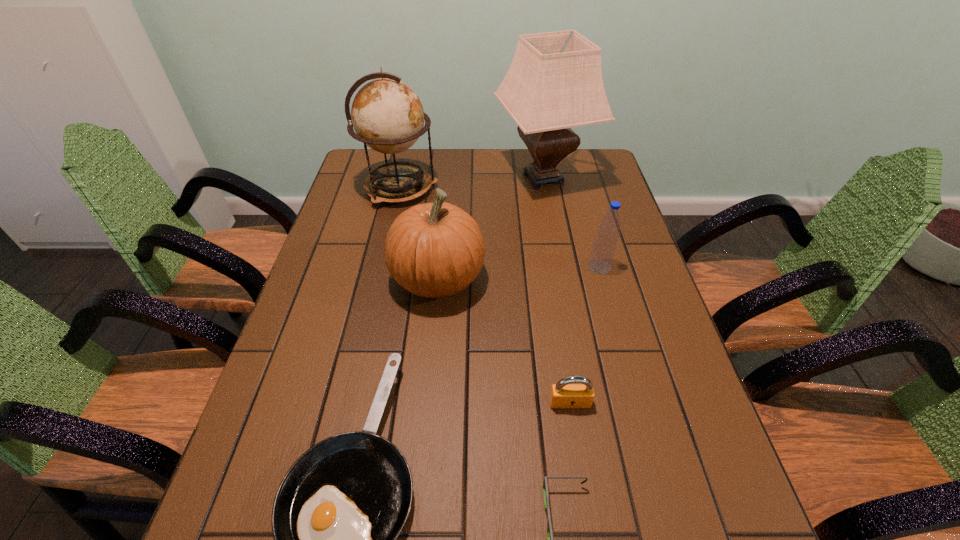
I want to click on lampshade, so click(x=554, y=83).

Identify the location of globe. (387, 115).

What are the coordinates of `the fifth shortest object` in the screenshot? It's located at (433, 250).

You are a GUI agent. You are given a task and a screenshot of the screen. Output one action in this format:
    pyautogui.click(x=<x>, y=<y>)
    Task: Click on the fourth shortest object
    The image size is (960, 540).
    Given the screenshot: What is the action you would take?
    pyautogui.click(x=604, y=247)

In order to click on padlock in this screenshot , I will do `click(564, 394)`.

At what (x,y) coordinates should I click in order to perform the action: click on vacant space located 0.330m on the front of the lampshade. Please return your answer as a coordinate pair (x, y). Image resolution: width=960 pixels, height=540 pixels. Looking at the image, I should click on (563, 282).

You are a GUI agent. You are given a task and a screenshot of the screen. Output one action in this format:
    pyautogui.click(x=<x>, y=<y>)
    Task: Click on the vacant space situated 0.340m at the center of the globe
    This screenshot has height=540, width=960.
    Given the screenshot: What is the action you would take?
    (539, 189)

The width and height of the screenshot is (960, 540). Identify the location of free region located 0.180m on the stem of the pumpkin. (552, 279).

Locate an element on the screen. free space located on the front of the water bottle is located at coordinates (615, 323).

Find the location of a particular element. This screenshot has height=540, width=960. vacant space located to unlock the third shortest object from the front is located at coordinates (578, 457).